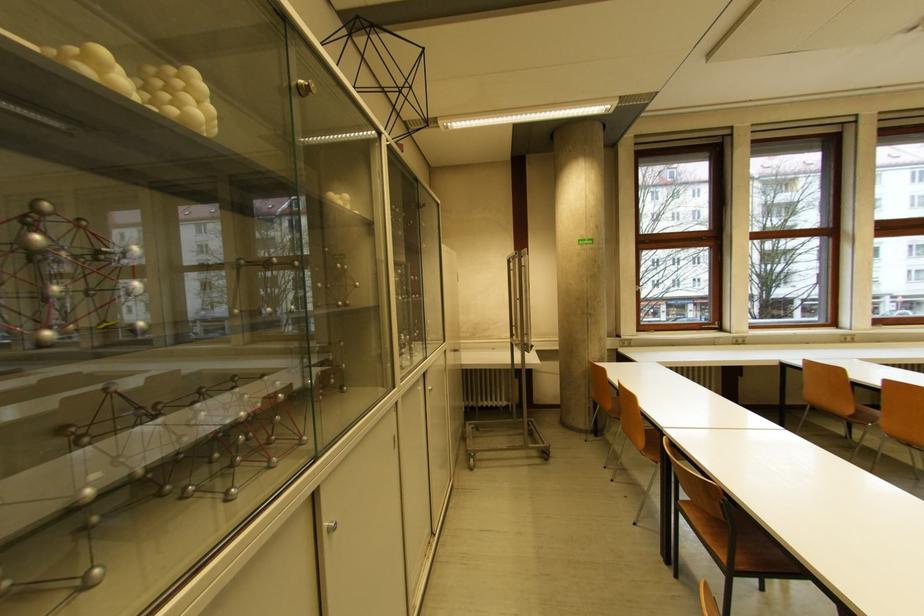
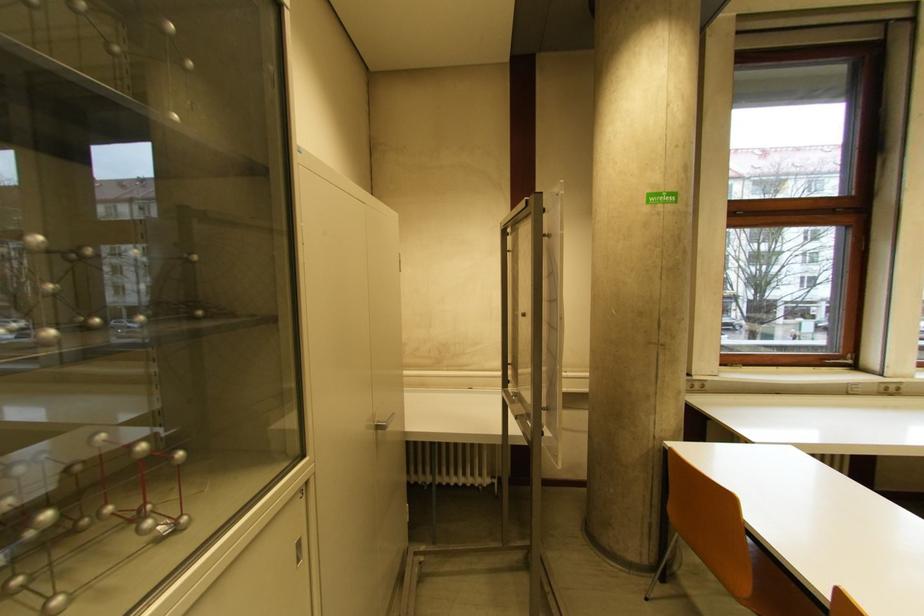
Question: The images are taken continuously from a first-person perspective. In which direction are you moving?

Choices:
 (A) Left
 (B) Right
 (C) Forward
 (D) Backward

Answer: (C)